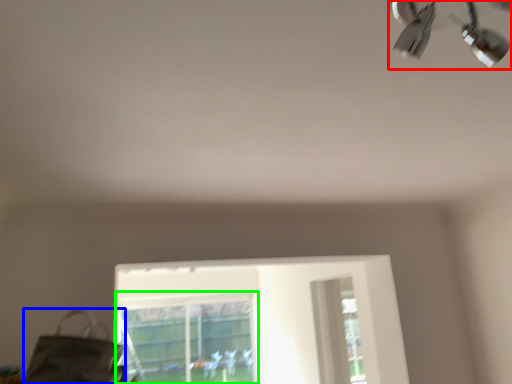
Question: Considering the real-world distances, which object is farthest from lamp (highlighted by a red box)? messenger bag (highlighted by a blue box) or bay window (highlighted by a green box)?

Choices:
 (A) messenger bag
 (B) bay window

Answer: (B)